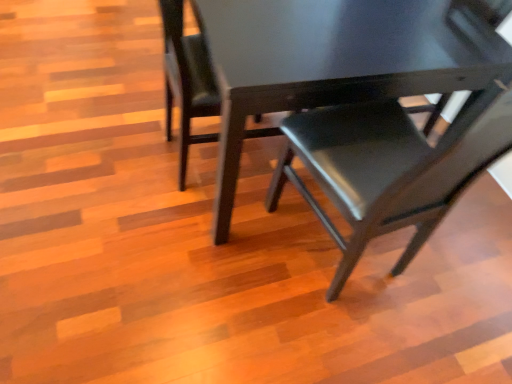
This screenshot has width=512, height=384. Describe the element at coordinates (187, 78) in the screenshot. I see `matte black chair at center, which ranks as the second chair in right-to-left order` at that location.

What is the approximate height of matte black chair at center, the 1th chair when ordered from left to right?

matte black chair at center, the 1th chair when ordered from left to right, is 32.55 inches tall.

What are the coordinates of `matte black chair at center, which ranks as the second chair in right-to-left order` in the screenshot? It's located at (187, 78).

Is the surface of matte black chair at center, which ranks as the 2th chair in left-to-right order, in direct contact with matte black chair at center, the 1th chair when ordered from left to right?

Yes, matte black chair at center, which ranks as the 2th chair in left-to-right order, is with matte black chair at center, the 1th chair when ordered from left to right.

How many degrees apart are the facing directions of matte black chair at center, which ranks as the 2th chair in left-to-right order, and matte black chair at center, the 1th chair when ordered from left to right?

There is a 0.487-degree angle between the facing directions of matte black chair at center, which ranks as the 2th chair in left-to-right order, and matte black chair at center, the 1th chair when ordered from left to right.

Where is `chair above the matte black chair at center, the 1th chair when ordered from left to right (from the image's perspective)`? chair above the matte black chair at center, the 1th chair when ordered from left to right (from the image's perspective) is located at coordinates (187, 78).

Considering the positions of objects matte black chair at center, which ranks as the second chair in right-to-left order, and matte black chair at center, the 1th chair when ordered from left to right, in the image provided, who is more to the right, matte black chair at center, which ranks as the second chair in right-to-left order, or matte black chair at center, the 1th chair when ordered from left to right,?

From the viewer's perspective, matte black chair at center, which ranks as the second chair in right-to-left order, appears more on the right side.

From a real-world perspective, is matte black chair at center, which ranks as the 2th chair in left-to-right order, physically above matte black chair at center, arranged as the 1th chair when viewed from the right?

No.

Is matte black chair at center, which ranks as the second chair in right-to-left order, looking in the opposite direction of matte black chair at center, the third chair viewed from the left?

No, matte black chair at center, which ranks as the second chair in right-to-left order,'s orientation is not away from matte black chair at center, the third chair viewed from the left.

Could matte black chair at center, the third chair viewed from the left, be considered to be inside matte black chair at center, which ranks as the 2th chair in left-to-right order?

No, matte black chair at center, the third chair viewed from the left, is not surrounded by matte black chair at center, which ranks as the 2th chair in left-to-right order.

Which is behind, matte black chair at center, the third chair viewed from the left, or matte black chair at center, which ranks as the second chair in right-to-left order?

matte black chair at center, which ranks as the second chair in right-to-left order, is further away from the camera.

Is matte black chair at center, arranged as the 1th chair when viewed from the right, touching matte black chair at center, which ranks as the 2th chair in left-to-right order?

No, matte black chair at center, arranged as the 1th chair when viewed from the right, is not with matte black chair at center, which ranks as the 2th chair in left-to-right order.

Find the location of a particular element. Image resolution: width=512 pixels, height=384 pixels. chair that is the 2nd one below the matte black chair at center, arranged as the 1th chair when viewed from the right (from a real-world perspective) is located at coordinates (187, 78).

Is matte black chair at center, the 3th chair in the right-to-left sequence, inside the boundaries of matte black chair at center, the third chair viewed from the left, or outside?

matte black chair at center, the 3th chair in the right-to-left sequence, exists outside the volume of matte black chair at center, the third chair viewed from the left.

Is matte black chair at center, the 1th chair when ordered from left to right, with matte black chair at center, arranged as the 1th chair when viewed from the right?

No, matte black chair at center, the 1th chair when ordered from left to right, is not touching matte black chair at center, arranged as the 1th chair when viewed from the right.

Is matte black chair at center, the 3th chair in the right-to-left sequence, facing towards matte black chair at center, the third chair viewed from the left?

No, matte black chair at center, the 3th chair in the right-to-left sequence, is not oriented towards matte black chair at center, the third chair viewed from the left.

Between matte black chair at center, the 3th chair in the right-to-left sequence, and matte black chair at center, arranged as the 1th chair when viewed from the right, which one appears on the right side from the viewer's perspective?

From the viewer's perspective, matte black chair at center, arranged as the 1th chair when viewed from the right, appears more on the right side.

Which point is more forward, (503,121) or (185,93)?

The point (503,121) is closer.

Considering the relative positions of matte black chair at center, the third chair viewed from the left, and matte black chair at center, the 3th chair in the right-to-left sequence, in the image provided, is matte black chair at center, the third chair viewed from the left, behind matte black chair at center, the 3th chair in the right-to-left sequence,?

No, matte black chair at center, the third chair viewed from the left, is closer to the camera.

Does matte black chair at center, arranged as the 1th chair when viewed from the right, have a smaller size compared to matte black chair at center, the 1th chair when ordered from left to right?

Actually, matte black chair at center, arranged as the 1th chair when viewed from the right, might be larger than matte black chair at center, the 1th chair when ordered from left to right.

Is matte black chair at center, arranged as the 1th chair when viewed from the right, taller or shorter than matte black chair at center, the 1th chair when ordered from left to right?

Considering their sizes, matte black chair at center, arranged as the 1th chair when viewed from the right, has more height than matte black chair at center, the 1th chair when ordered from left to right.

This screenshot has height=384, width=512. Find the location of `chair beneath the matte black chair at center, the 1th chair when ordered from left to right (from a real-world perspective)`. chair beneath the matte black chair at center, the 1th chair when ordered from left to right (from a real-world perspective) is located at coordinates (187, 78).

Which is in front, matte black chair at center, the 3th chair in the right-to-left sequence, or matte black chair at center, which ranks as the 2th chair in left-to-right order?

matte black chair at center, which ranks as the 2th chair in left-to-right order.

Considering the points (182, 25) and (201, 140), which point is behind, point (182, 25) or point (201, 140)?

The point (201, 140) is farther.

Is matte black chair at center, the 3th chair in the right-to-left sequence, not close to matte black chair at center, which ranks as the 2th chair in left-to-right order?

No.

You are a GUI agent. You are given a task and a screenshot of the screen. Output one action in this format:
    pyautogui.click(x=<x>, y=<y>)
    Task: Click on the chair on the left of matte black chair at center, which ranks as the 2th chair in left-to-right order
    This screenshot has width=512, height=384.
    Given the screenshot: What is the action you would take?
    pyautogui.click(x=187, y=79)

Where is `chair that is the 2nd one below the matte black chair at center, arranged as the 1th chair when viewed from the right (from a real-world perspective)`? This screenshot has width=512, height=384. chair that is the 2nd one below the matte black chair at center, arranged as the 1th chair when viewed from the right (from a real-world perspective) is located at coordinates (187, 78).

Estimate the real-world distances between objects in this image. Which object is further from matte black chair at center, which ranks as the second chair in right-to-left order, matte black chair at center, the 1th chair when ordered from left to right, or matte black chair at center, arranged as the 1th chair when viewed from the right?

matte black chair at center, arranged as the 1th chair when viewed from the right, is further to matte black chair at center, which ranks as the second chair in right-to-left order.

Estimate the real-world distances between objects in this image. Which object is closer to matte black chair at center, the third chair viewed from the left, matte black chair at center, the 1th chair when ordered from left to right, or matte black chair at center, which ranks as the 2th chair in left-to-right order?

matte black chair at center, the 1th chair when ordered from left to right, is positioned closer to the anchor matte black chair at center, the third chair viewed from the left.

Based on their spatial positions, is matte black chair at center, which ranks as the second chair in right-to-left order, or matte black chair at center, arranged as the 1th chair when viewed from the right, further from matte black chair at center, the 1th chair when ordered from left to right?

matte black chair at center, arranged as the 1th chair when viewed from the right, lies further to matte black chair at center, the 1th chair when ordered from left to right, than the other object.

When comparing their distances from matte black chair at center, the 3th chair in the right-to-left sequence, does matte black chair at center, arranged as the 1th chair when viewed from the right, or matte black chair at center, which ranks as the second chair in right-to-left order, seem closer?

matte black chair at center, which ranks as the second chair in right-to-left order, is closer to matte black chair at center, the 3th chair in the right-to-left sequence.

Based on their spatial positions, is matte black chair at center, which ranks as the second chair in right-to-left order, or matte black chair at center, the 1th chair when ordered from left to right, further from matte black chair at center, the third chair viewed from the left?

Based on the image, matte black chair at center, which ranks as the second chair in right-to-left order, appears to be further to matte black chair at center, the third chair viewed from the left.

In the scene shown: Estimate the real-world distances between objects in this image. Which object is further from matte black chair at center, which ranks as the second chair in right-to-left order, matte black chair at center, arranged as the 1th chair when viewed from the right, or matte black chair at center, the 1th chair when ordered from left to right?

matte black chair at center, arranged as the 1th chair when viewed from the right, is positioned further to the anchor matte black chair at center, which ranks as the second chair in right-to-left order.

You are a GUI agent. You are given a task and a screenshot of the screen. Output one action in this format:
    pyautogui.click(x=<x>, y=<y>)
    Task: Click on the chair between matte black chair at center, the 3th chair in the right-to-left sequence, and matte black chair at center, the third chair viewed from the left, in the horizontal direction
    
    Given the screenshot: What is the action you would take?
    pos(187,78)